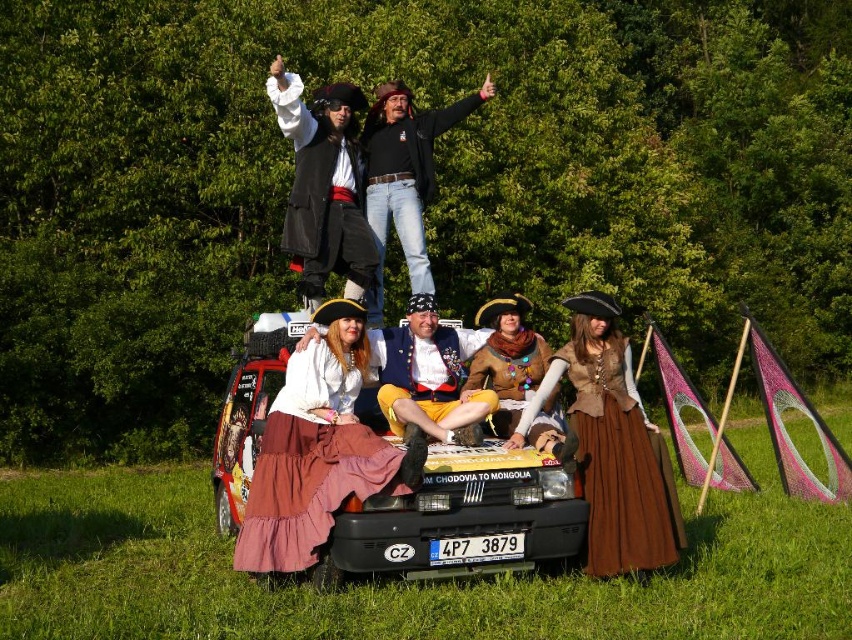
Question: Can you confirm if rustic cotton skirt at center is bigger than matte black coat at upper center?

Choices:
 (A) no
 (B) yes

Answer: (B)

Question: Which point is farther from the camera taking this photo?

Choices:
 (A) (406, 90)
 (B) (596, 444)
 (C) (490, 380)
 (D) (273, 72)

Answer: (A)

Question: Which object appears closest to the camera in this image?

Choices:
 (A) leather vest at center
 (B) matte black coat at upper center

Answer: (A)

Question: Which object is positioned farthest from the velvet yellow pants at center?

Choices:
 (A) brown leather vest at center
 (B) matte black car at center
 (C) matte black coat at upper center
 (D) leather vest at center

Answer: (C)

Question: Is rustic cotton skirt at center bigger than velvet yellow pants at center?

Choices:
 (A) yes
 (B) no

Answer: (A)

Question: Can you confirm if rustic cotton skirt at center is positioned below velvet yellow pants at center?

Choices:
 (A) yes
 (B) no

Answer: (A)